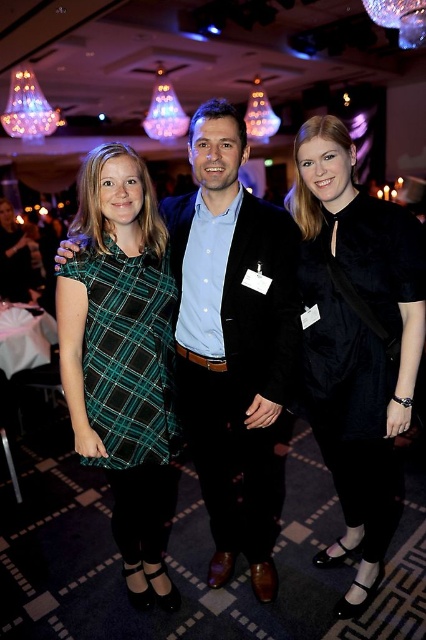
Question: Can you confirm if velvet black dress at center is positioned to the right of green plaid dress at left?

Choices:
 (A) no
 (B) yes

Answer: (B)

Question: Which of these objects is positioned closest to the matte black suit at center?

Choices:
 (A) green plaid dress at left
 (B) velvet black dress at center

Answer: (A)

Question: Can you confirm if velvet black dress at center is thinner than green plaid dress at left?

Choices:
 (A) no
 (B) yes

Answer: (A)

Question: Is matte black suit at center to the left of green plaid dress at left from the viewer's perspective?

Choices:
 (A) yes
 (B) no

Answer: (B)

Question: Which of the following is the closest to the observer?

Choices:
 (A) (385, 541)
 (B) (224, 326)

Answer: (B)

Question: Which point is closer to the camera taking this photo?

Choices:
 (A) (123, 321)
 (B) (337, 337)
 (C) (189, 291)

Answer: (A)